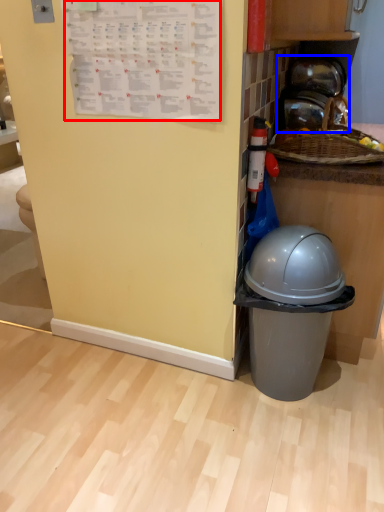
Question: Which object appears farthest to the camera in this image, writing (highlighted by a red box) or appliance (highlighted by a blue box)?

Choices:
 (A) writing
 (B) appliance

Answer: (B)